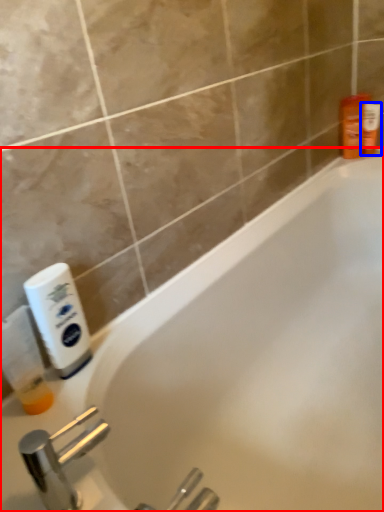
Question: Among these objects, which one is nearest to the camera, bathtub (highlighted by a red box) or toiletry (highlighted by a blue box)?

Choices:
 (A) bathtub
 (B) toiletry

Answer: (A)